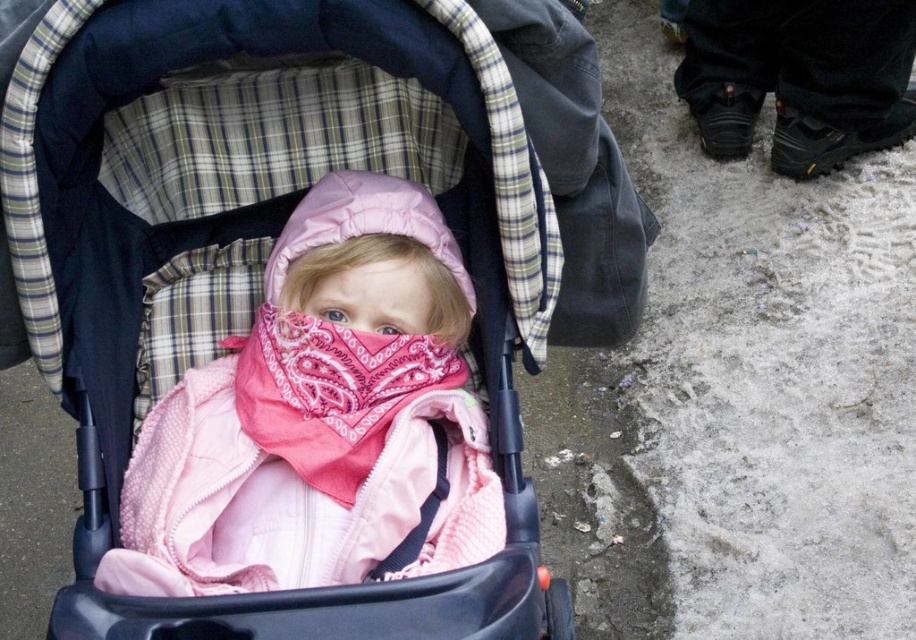
Looking at this image, you are a photographer trying to capture the child in the stroller. The stroller is at the center of the image. There is a point marked at coordinates point (320, 417). Where is this point located relative to the pink quilted jacket at center?

The point (320, 417) is located at the position of the pink quilted jacket at center.